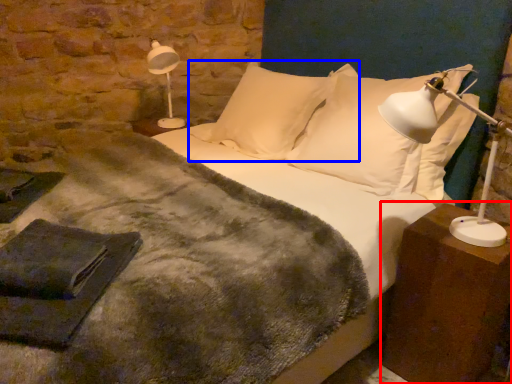
Question: Which object appears farthest to the camera in this image, nightstand (highlighted by a red box) or pillow (highlighted by a blue box)?

Choices:
 (A) nightstand
 (B) pillow

Answer: (B)